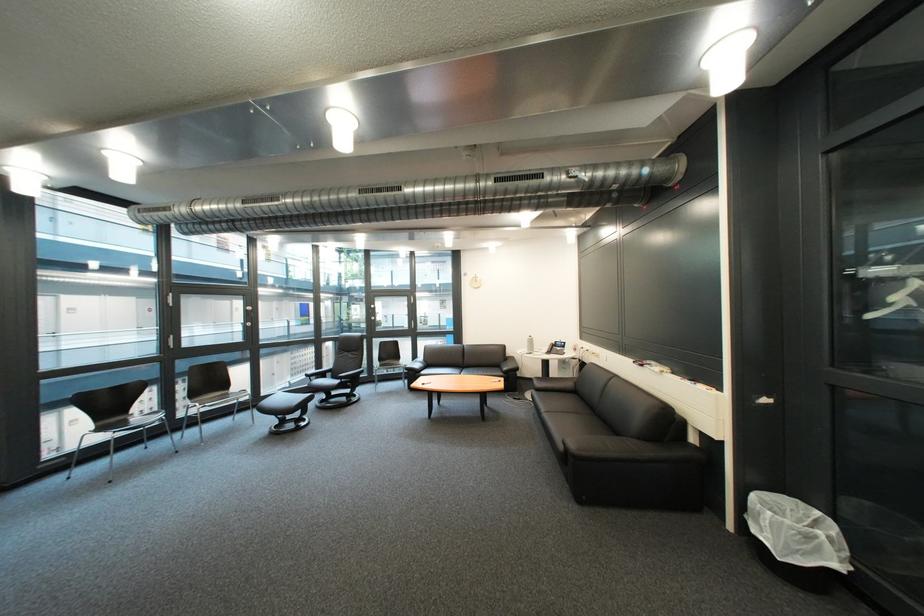
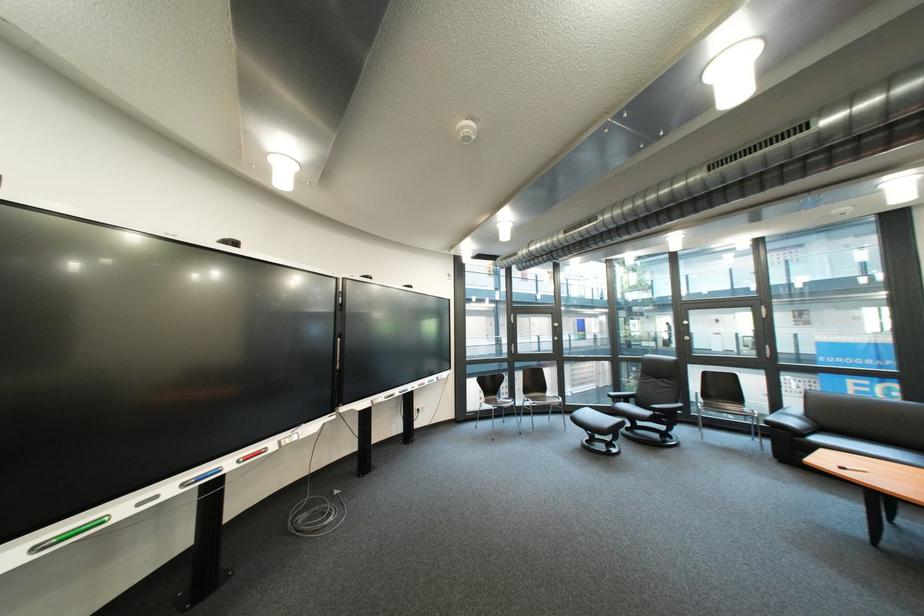
The point at (334, 371) is marked in the first image. Where is the corresponding point in the second image?

(634, 392)